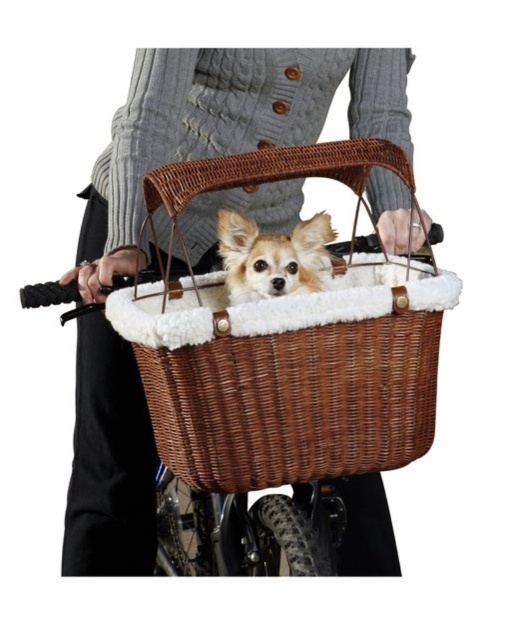
Who is taller, woven brown basket at center or light brown fur dog at center?

woven brown basket at center is taller.

What do you see at coordinates (295, 400) in the screenshot? I see `woven brown basket at center` at bounding box center [295, 400].

At what (x,y) coordinates should I click in order to perform the action: click on woven brown basket at center. Please return your answer as a coordinate pair (x, y). The height and width of the screenshot is (640, 511). Looking at the image, I should click on (295, 400).